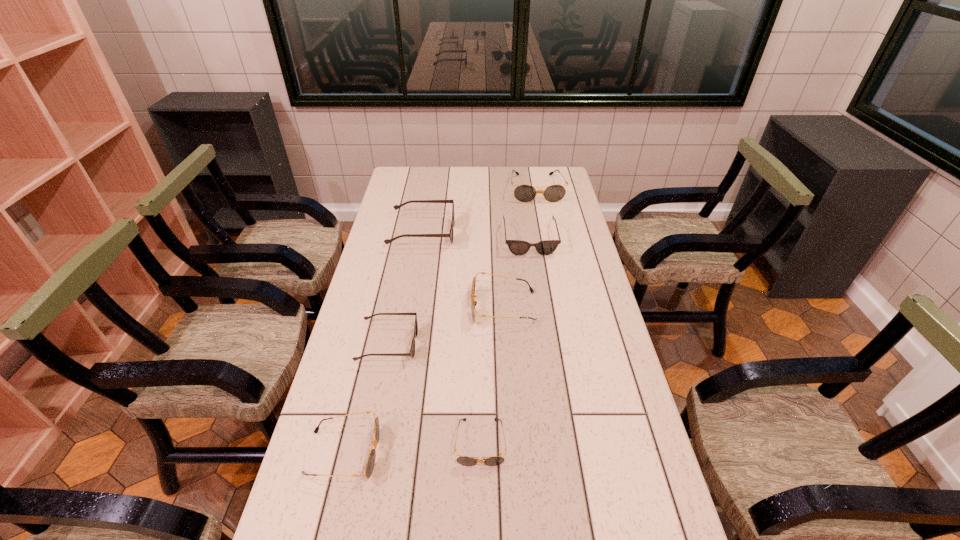
Find the location of a particular element. free space located 0.220m on the front lenses of the biggest brown sunglasses is located at coordinates (510, 233).

This screenshot has width=960, height=540. Identify the location of free point located on the front-facing side of the third smallest black sunglasses. click(440, 307).

Find the location of `vacant space located on the front-facing side of the third smallest black sunglasses`. vacant space located on the front-facing side of the third smallest black sunglasses is located at coordinates (440, 307).

You are a GUI agent. You are given a task and a screenshot of the screen. Output one action in this format:
    pyautogui.click(x=<x>, y=<y>)
    Task: Click on the vacant region located on the front-facing side of the third smallest black sunglasses
    This screenshot has height=540, width=960.
    Given the screenshot: What is the action you would take?
    pyautogui.click(x=399, y=307)

This screenshot has height=540, width=960. In order to click on free space located 0.120m on the front lenses of the second biggest brown sunglasses in this screenshot , I will do `click(535, 277)`.

Find the location of a particular element. The width and height of the screenshot is (960, 540). free space located on the front-facing side of the leftmost black sunglasses is located at coordinates (458, 453).

Locate an element on the screen. The width and height of the screenshot is (960, 540). vacant region located on the front lenses of the smallest brown sunglasses is located at coordinates (470, 344).

At what (x,y) coordinates should I click in order to perform the action: click on free space located 0.100m on the front-facing side of the smallest black sunglasses. Please return your answer as a coordinate pair (x, y). The width and height of the screenshot is (960, 540). Looking at the image, I should click on (480, 513).

What are the coordinates of `object located at the far edge` in the screenshot? It's located at (524, 193).

At what (x,y) coordinates should I click in order to perform the action: click on object that is at the far right corner. Please return your answer as a coordinate pair (x, y). This screenshot has height=540, width=960. Looking at the image, I should click on (524, 193).